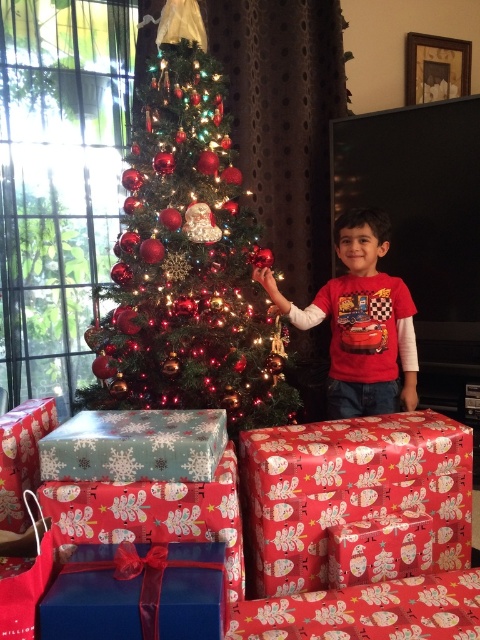
You are a parent trying to ensure the red matte shirt at center is placed safely away from the shiny green christmas tree at center. The safety guideline states that the shirt must be at least 15 inches away from the tree to prevent accidental contact. Based on the scene description, is the current placement compliant with the safety guideline?

The shiny green christmas tree at center is 14.67 inches from the red matte shirt at center. Since 14.67 inches is less than the required 15 inches, the current placement does not comply with the safety guideline.

You are a delivery person holding a large box that is 1.8 meters tall. You need to place it near the shiny green christmas tree at center without blocking the camera view. Is the space between you and the tree sufficient to do so?

The distance between you and the shiny green christmas tree at center is 2.04 meters, which is greater than the height of the box, so placing the box near the tree without blocking the camera view is possible.

In the scene shown: You are standing in front of the Christmas tree and notice two points marked on the presents. Which point, point (372, 420) or point (383, 333), is closer to you?

Point (372, 420) is closer to the viewer than point (383, 333).